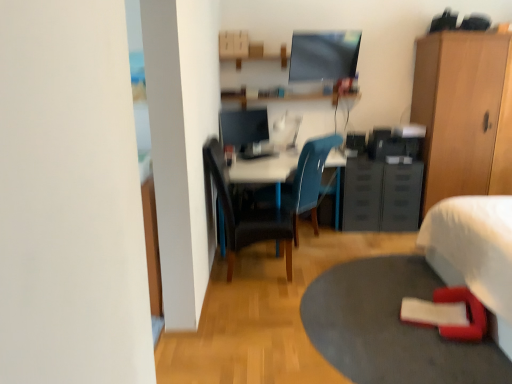
Image resolution: width=512 pixels, height=384 pixels. I want to click on free space underneath black leather chair at center, placed as the first chair when sorted from front to back (from a real-world perspective), so click(253, 274).